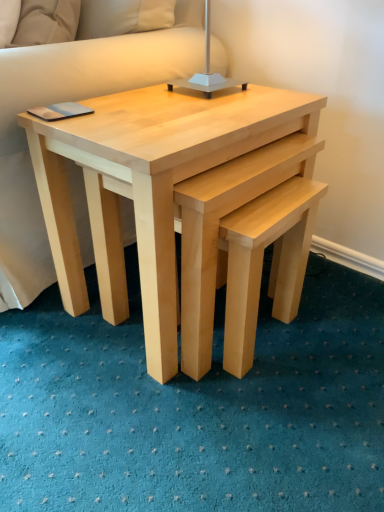
In order to click on vacant space in front of metallic silver table lamp at upper center in this screenshot , I will do `click(187, 112)`.